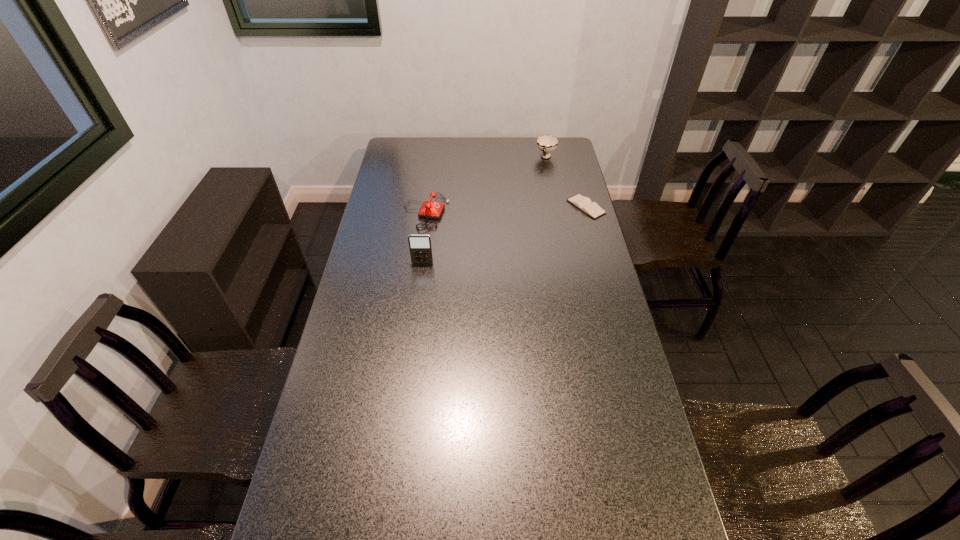
Where is `vacant space on the desktop that is between the nearest object and the diary and is positioned on the dial of the third tallest object`? This screenshot has height=540, width=960. vacant space on the desktop that is between the nearest object and the diary and is positioned on the dial of the third tallest object is located at coordinates tap(531, 225).

The image size is (960, 540). Identify the location of vacant space on the desktop that is between the tallest object and the shortest object and is positioned on the side of the cup with the handle. (519, 230).